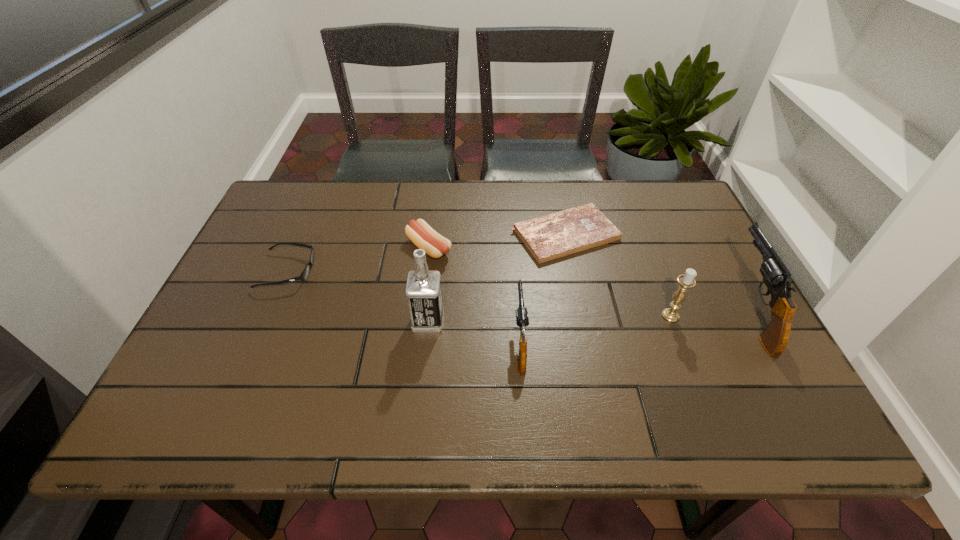
You are a GUI agent. You are given a task and a screenshot of the screen. Output one action in this format:
    pyautogui.click(x=<x>, y=<y>)
    Task: Click on the free point that satisfies the following two spatial constraints: 1. along the barrel of the Bible; 2. on the right side of the shorter gun
    The width and height of the screenshot is (960, 540).
    Given the screenshot: What is the action you would take?
    pyautogui.click(x=512, y=234)

Where is `vacant space that satisfies the following two spatial constraints: 1. on the front-facing side of the sixth object from left to right; 2. on the right side of the sunglasses`? vacant space that satisfies the following two spatial constraints: 1. on the front-facing side of the sixth object from left to right; 2. on the right side of the sunglasses is located at coordinates (269, 315).

This screenshot has width=960, height=540. I want to click on free region that satisfies the following two spatial constraints: 1. along the barrel of the fourth tallest object; 2. on the front-facing side of the sunglasses, so click(515, 271).

Where is `free space that satisfies the following two spatial constraints: 1. on the front-facing side of the sunglasses; 2. along the barrel of the shorter gun`? The height and width of the screenshot is (540, 960). free space that satisfies the following two spatial constraints: 1. on the front-facing side of the sunglasses; 2. along the barrel of the shorter gun is located at coordinates (257, 341).